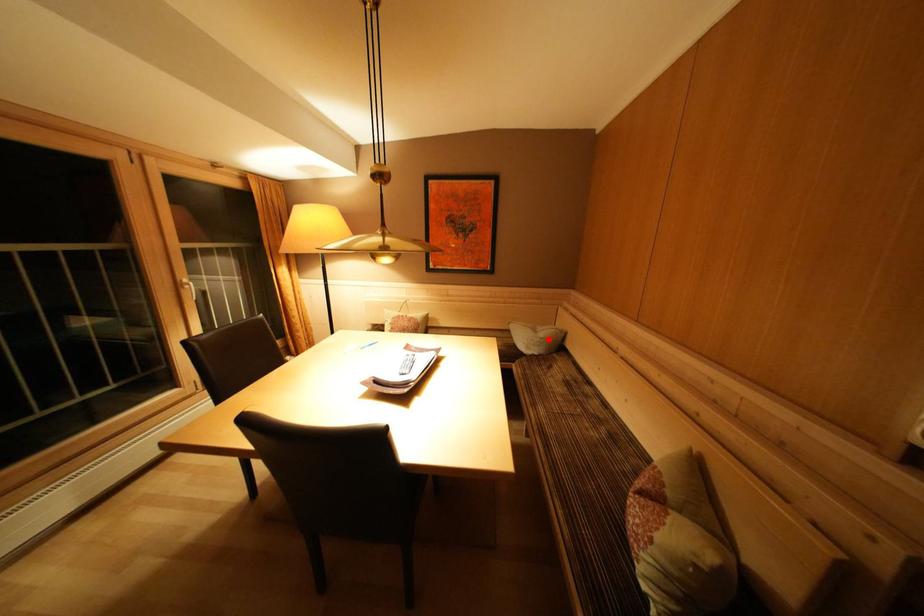
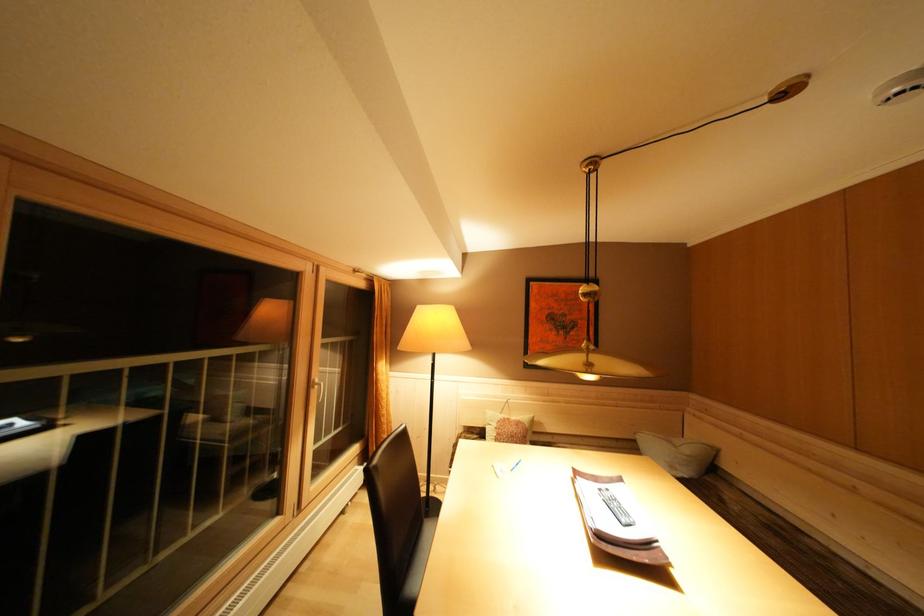
The point at the highlighted location is marked in the first image. Where is the corresponding point in the second image?

(695, 456)